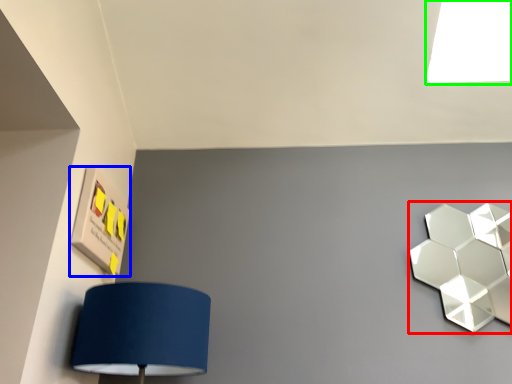
Question: Which object is the closest to the lamp (highlighted by a red box)? Choose among these: square (highlighted by a blue box) or light (highlighted by a green box).

Choices:
 (A) square
 (B) light

Answer: (B)